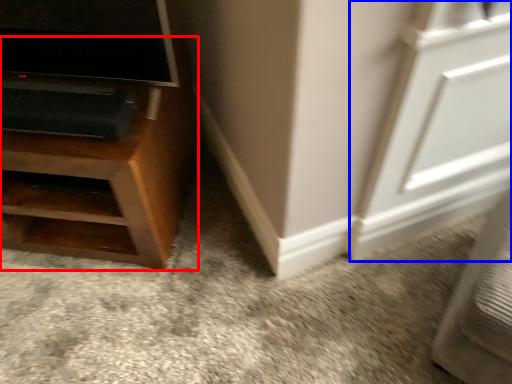
Question: Which point is closer to the camera, furniture (highlighted by a red box) or screen door (highlighted by a blue box)?

Choices:
 (A) furniture
 (B) screen door

Answer: (B)